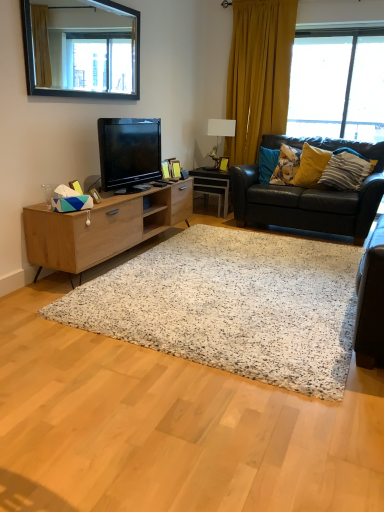
Question: Is white ceramic lamp at upper center thinner than black leather couch at right?

Choices:
 (A) no
 (B) yes

Answer: (B)

Question: Considering the relative sizes of white ceramic lamp at upper center and black leather couch at right in the image provided, is white ceramic lamp at upper center wider than black leather couch at right?

Choices:
 (A) no
 (B) yes

Answer: (A)

Question: Can you confirm if white ceramic lamp at upper center is positioned to the right of black leather couch at right?

Choices:
 (A) no
 (B) yes

Answer: (A)

Question: From a real-world perspective, is white ceramic lamp at upper center positioned over black leather couch at right based on gravity?

Choices:
 (A) yes
 (B) no

Answer: (A)

Question: Does white ceramic lamp at upper center lie in front of black leather couch at right?

Choices:
 (A) yes
 (B) no

Answer: (B)

Question: Considering the relative positions of white glossy desk at center and white ceramic lamp at upper center in the image provided, is white glossy desk at center to the left or to the right of white ceramic lamp at upper center?

Choices:
 (A) left
 (B) right

Answer: (A)

Question: Considering the positions of white glossy desk at center and white ceramic lamp at upper center in the image, is white glossy desk at center wider or thinner than white ceramic lamp at upper center?

Choices:
 (A) thin
 (B) wide

Answer: (B)

Question: From their relative heights in the image, would you say white glossy desk at center is taller or shorter than white ceramic lamp at upper center?

Choices:
 (A) tall
 (B) short

Answer: (B)

Question: From the image's perspective, relative to white ceramic lamp at upper center, is white glossy desk at center above or below?

Choices:
 (A) below
 (B) above

Answer: (A)

Question: Does point (314, 326) appear closer or farther from the camera than point (311, 152)?

Choices:
 (A) farther
 (B) closer

Answer: (B)

Question: In the image, is white speckled rug at center on the left side or the right side of yellow fabric pillow at right, the second pillow positioned from the left?

Choices:
 (A) left
 (B) right

Answer: (A)

Question: From a real-world perspective, is white speckled rug at center positioned above or below yellow fabric pillow at right, the second pillow positioned from the left?

Choices:
 (A) below
 (B) above

Answer: (A)

Question: In terms of height, does white speckled rug at center look taller or shorter compared to yellow fabric pillow at right, the 2th pillow positioned from the right?

Choices:
 (A) short
 (B) tall

Answer: (A)

Question: Is white speckled rug at center situated inside black leather couch at right or outside?

Choices:
 (A) inside
 (B) outside

Answer: (B)

Question: Is white speckled rug at center to the left or to the right of black leather couch at right in the image?

Choices:
 (A) right
 (B) left

Answer: (B)